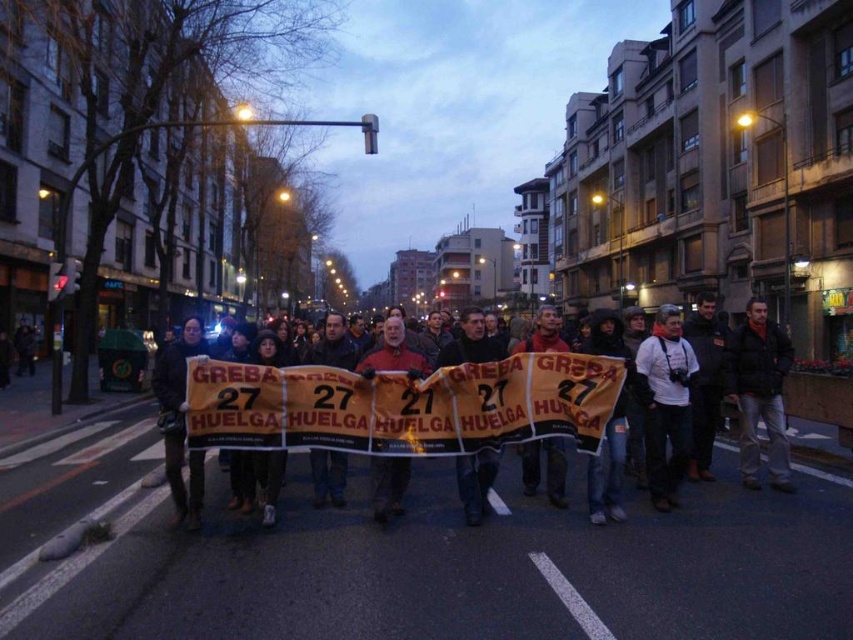
From the picture: Is white fabric camera at center taller than dark blue jacket at right?

Incorrect, white fabric camera at center's height is not larger of dark blue jacket at right's.

Can you confirm if white fabric camera at center is positioned to the right of dark blue jacket at right?

→ Incorrect, white fabric camera at center is not on the right side of dark blue jacket at right.

You are a GUI agent. You are given a task and a screenshot of the screen. Output one action in this format:
    pyautogui.click(x=<x>, y=<y>)
    Task: Click on the white fabric camera at center
    Image resolution: width=853 pixels, height=640 pixels.
    Given the screenshot: What is the action you would take?
    pyautogui.click(x=665, y=404)

Based on the photo, is white fabric camera at center closer to the viewer compared to reddish-brown leather jacket at center?

No.

Who is shorter, white fabric camera at center or reddish-brown leather jacket at center?

reddish-brown leather jacket at center

Who is more distant from viewer, (651, 410) or (392, 481)?

The point (651, 410) is behind.

Where is `white fabric camera at center`? The image size is (853, 640). white fabric camera at center is located at coordinates (665, 404).

Based on the photo, which is below, orange fabric banner at center or white fabric camera at center?

white fabric camera at center is lower down.

Between point (474, 408) and point (669, 417), which one is positioned behind?

Point (669, 417)

Who is more forward, (369, 449) or (650, 448)?

Point (369, 449)

At what (x,y) coordinates should I click in order to perform the action: click on orange fabric banner at center. Please return your answer as a coordinate pair (x, y). Looking at the image, I should click on (419, 406).